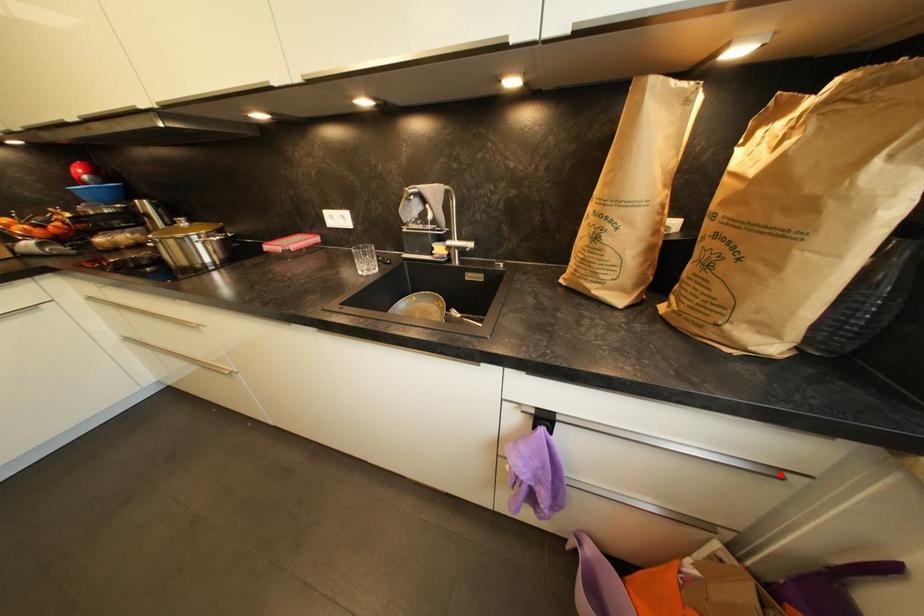
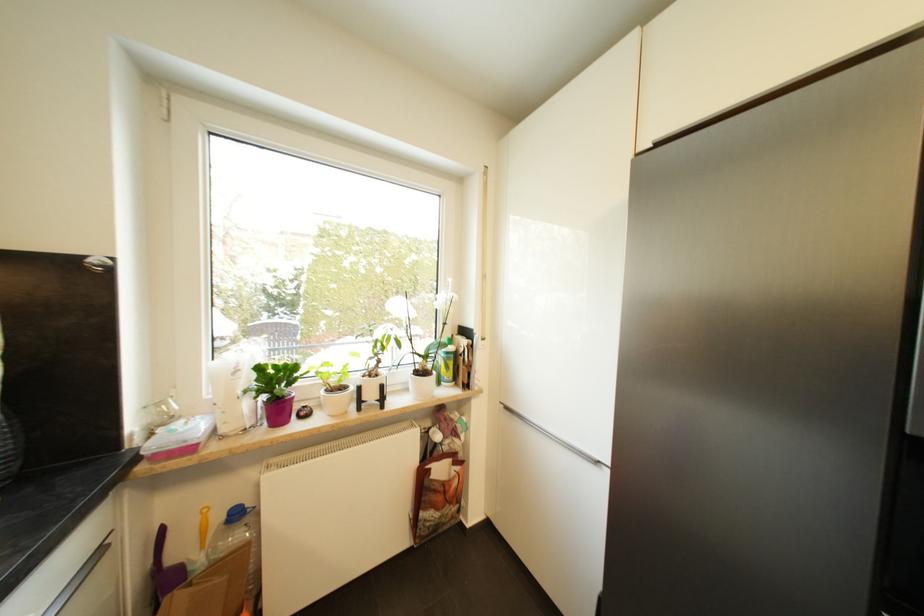
Find the pixel in the second image that matches the highlighted location in the first image.

(105, 553)